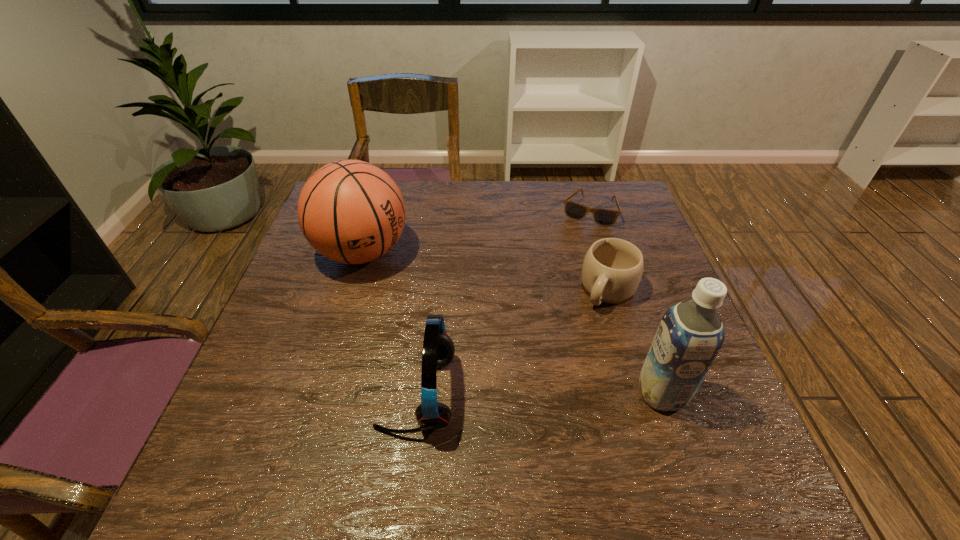
Where is `vacant region located on the label of the soya milk`? The width and height of the screenshot is (960, 540). vacant region located on the label of the soya milk is located at coordinates (535, 393).

Identify the location of vacant space located on the frames of the sunglasses. (562, 280).

At what (x,y) coordinates should I click in order to perform the action: click on vacant space located 0.050m on the frames of the sunglasses. Please return your answer as a coordinate pair (x, y). Looking at the image, I should click on (579, 235).

You are a GUI agent. You are given a task and a screenshot of the screen. Output one action in this format:
    pyautogui.click(x=<x>, y=<y>)
    Task: Click on the vacant space located 0.210m on the frames of the sunglasses
    
    Given the screenshot: What is the action you would take?
    pyautogui.click(x=565, y=271)

You are a GUI agent. You are given a task and a screenshot of the screen. Output one action in this format:
    pyautogui.click(x=<x>, y=<y>)
    Task: Click on the blank space located on the surface of the basketball near the brand logo
    
    Given the screenshot: What is the action you would take?
    [452, 331]

Where is `free region located on the surface of the basketball near the brand logo`? The width and height of the screenshot is (960, 540). free region located on the surface of the basketball near the brand logo is located at coordinates (428, 310).

The height and width of the screenshot is (540, 960). I want to click on vacant space located 0.260m on the surface of the basketball near the brand logo, so click(x=455, y=334).

This screenshot has width=960, height=540. I want to click on free space located 0.290m on the side of the mug with the handle, so click(543, 402).

This screenshot has width=960, height=540. I want to click on vacant space located on the side of the mug with the handle, so click(524, 434).

I want to click on free space located on the side of the mug with the handle, so click(573, 354).